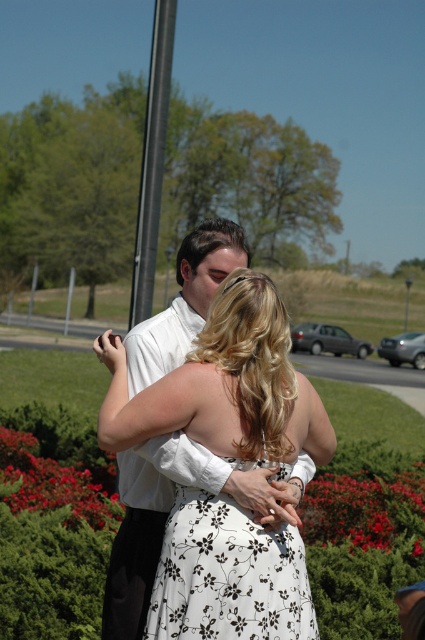
You are a photographer at a wedding and you need to capture a photo of the white floral dress at center and the silver metallic sedan at center. Based on their positions, which object is closer to the camera?

The white floral dress at center is in front of the silver metallic sedan at center, so the white floral dress at center is closer to the camera.

You are a photographer at this event and need to position yourself so that the white floral fabric dress at center is framed between the black smooth pole at upper center and another object. Which object is the dress positioned below?

The white floral fabric dress at center is located below the black smooth pole at upper center.

You are a photographer at a wedding venue and need to capture a photo of the white floral dress at center and the silver metallic sedan at center. The camera you are using has a maximum focus range of 30 meters. Will you be able to focus on both subjects clearly?

The distance between the white floral dress at center and the silver metallic sedan at center is 32.25 meters. Since the camera can only focus up to 30 meters, it will not be able to capture both subjects in focus simultaneously.